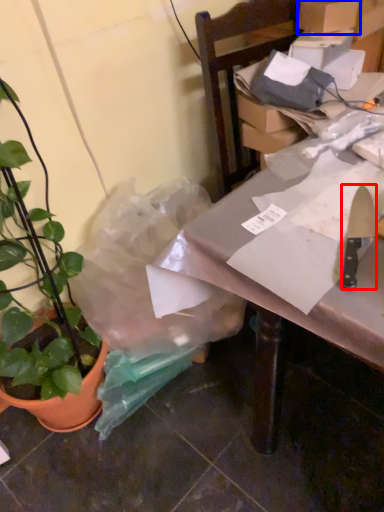
Question: Among these objects, which one is nearest to the camera, kitchen knife (highlighted by a red box) or cardboard box (highlighted by a blue box)?

Choices:
 (A) kitchen knife
 (B) cardboard box

Answer: (A)